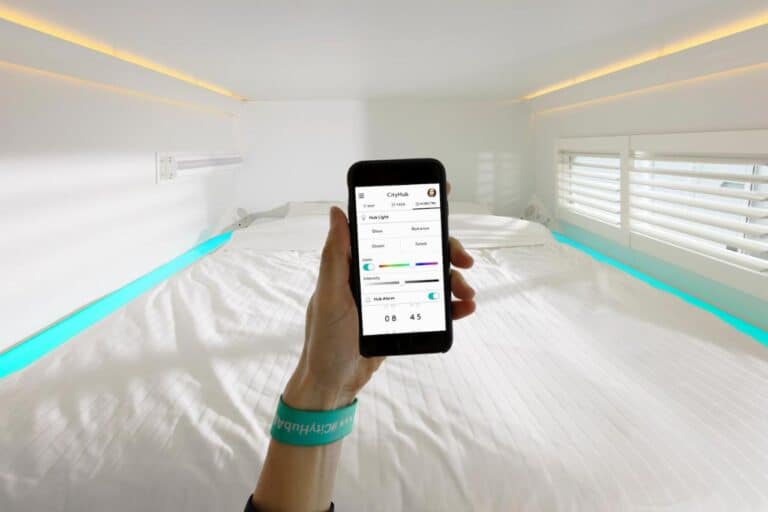
Locate an element on the screen. window frame is located at coordinates (710, 139), (604, 144).